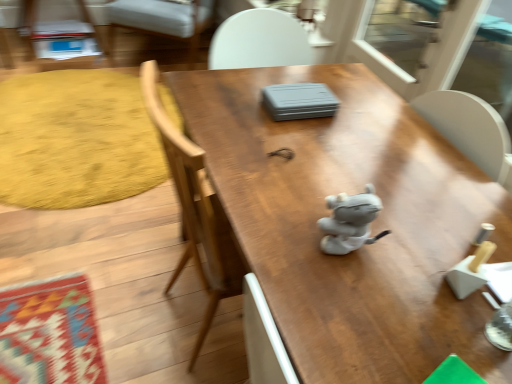
Question: In terms of height, does yellow textured rug at left look taller or shorter compared to gray fabric toy at center?

Choices:
 (A) short
 (B) tall

Answer: (A)

Question: From a real-world perspective, is yellow textured rug at left physically located above or below gray fabric toy at center?

Choices:
 (A) above
 (B) below

Answer: (B)

Question: Which of these objects is positioned closest to the transparent plastic screen door at upper right?

Choices:
 (A) yellow textured rug at left
 (B) gray fabric toy at center
 (C) white fabric chair at upper left
 (D) wooden table at center

Answer: (D)

Question: Estimate the real-world distances between objects in this image. Which object is closer to the transparent plastic screen door at upper right?

Choices:
 (A) wooden table at center
 (B) white fabric chair at upper left
 (C) gray fabric toy at center
 (D) yellow textured rug at left

Answer: (A)